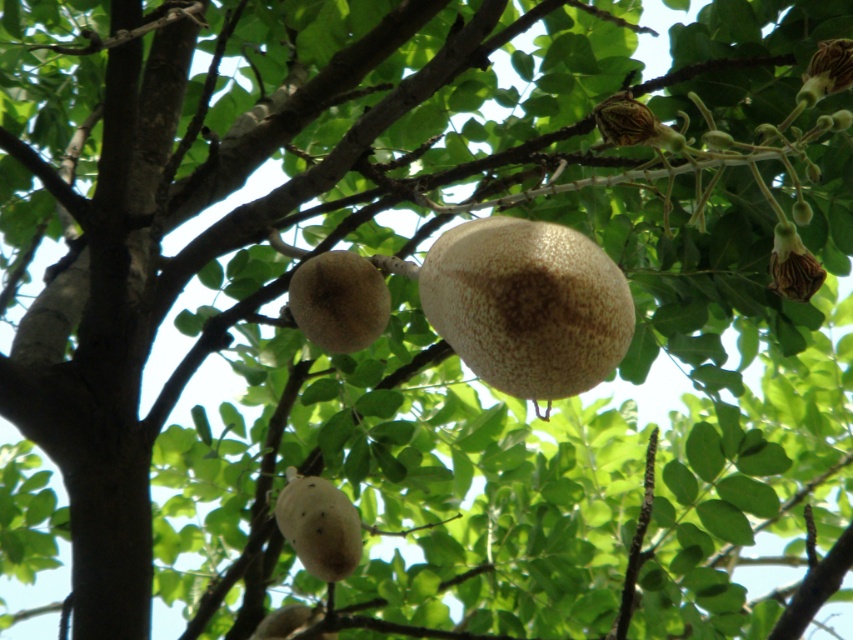
In the scene shown: You are an artist sketching this tree. You need to decide which object to draw first based on their sizes. Which one should you start with, the speckled brown fruit at center or the brown textured flower at upper right?

The speckled brown fruit at center is wider than the brown textured flower at upper right, so you should start with the speckled brown fruit at center since it is larger in width.

You are standing in front of the tree and notice two points marked on the branches. The first point is at coordinate point (325,548) and the second is at point (775,234). Which point is closer to you?

Point (775,234) is closer to you because point (325,548) is behind it.